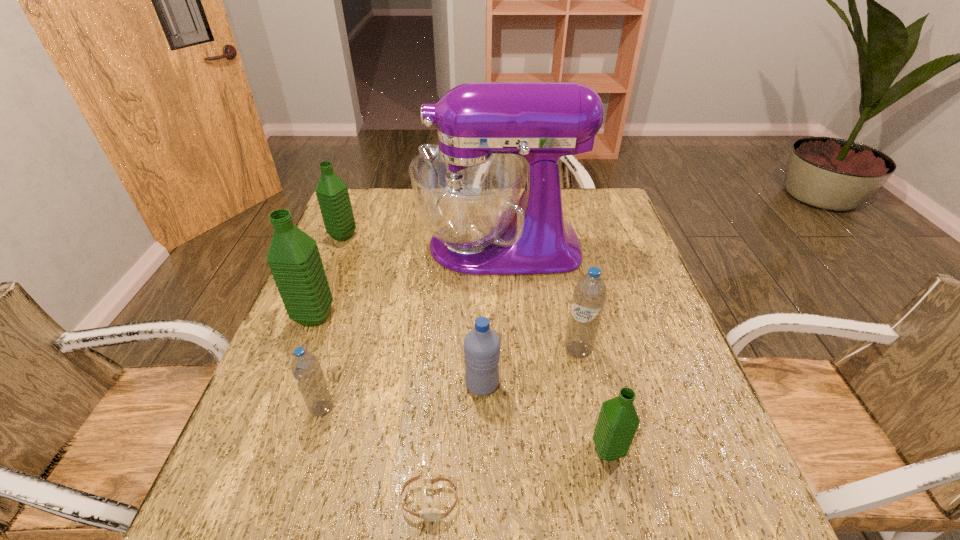
Identify the location of vacant region located 0.060m on the front of the fifth nearest object. (585, 384).

You are a GUI agent. You are given a task and a screenshot of the screen. Output one action in this format:
    pyautogui.click(x=<x>, y=<y>)
    Task: Click on the blank space located 0.400m on the right of the fourth water bottle from left to right
    The width and height of the screenshot is (960, 540).
    Given the screenshot: What is the action you would take?
    pyautogui.click(x=686, y=384)

At what (x,y) coordinates should I click in order to perform the action: click on vacant space located 0.200m on the left of the smallest green water bottle. Please return your answer as a coordinate pair (x, y). The height and width of the screenshot is (540, 960). Looking at the image, I should click on (487, 450).

The image size is (960, 540). I want to click on vacant area located 0.380m on the back of the third object from left to right, so click(362, 278).

I want to click on object that is at the far edge, so click(467, 189).

Identify the location of object that is at the near edge. The height and width of the screenshot is (540, 960). [x=429, y=514].

Locate an element on the screen. vacant space at the near edge of the desktop is located at coordinates (485, 498).

Locate an element on the screen. vacant region at the left edge of the desktop is located at coordinates (368, 234).

Where is `vacant space at the right edge of the desktop`? vacant space at the right edge of the desktop is located at coordinates (656, 382).

In the image, there is a desktop. Identify the location of vacant space at the far right corner. This screenshot has height=540, width=960. (574, 195).